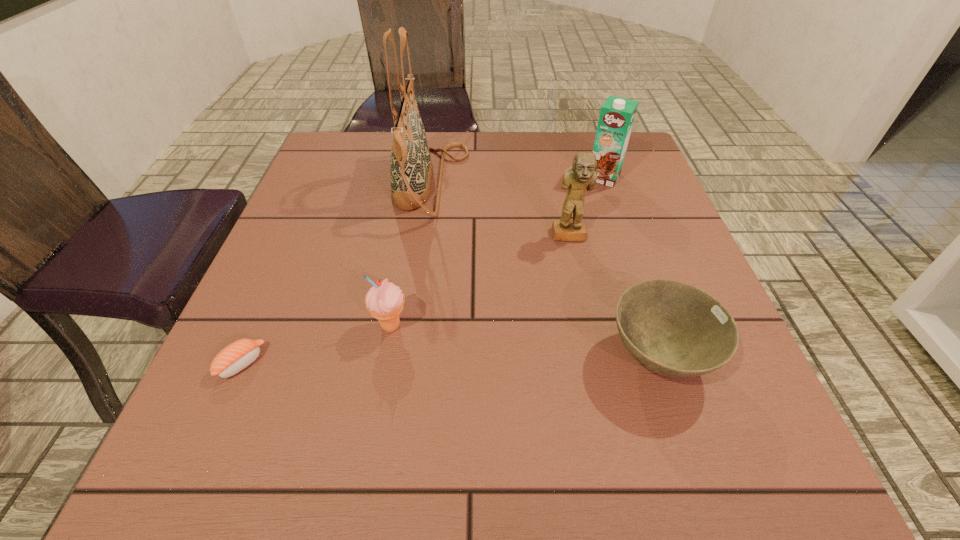
Find the location of a particular element. This screenshot has height=540, width=960. free space at the near edge is located at coordinates (637, 470).

Find the location of a particular element. This screenshot has height=540, width=960. vacant region at the left edge of the desktop is located at coordinates (288, 253).

Locate an element on the screen. Image resolution: width=960 pixels, height=540 pixels. vacant space at the right edge of the desktop is located at coordinates (636, 180).

Where is `free spot at the near right corner of the desktop`? This screenshot has width=960, height=540. free spot at the near right corner of the desktop is located at coordinates (706, 485).

At what (x,y) coordinates should I click in order to perform the action: click on free point between the leftmost object and the carton. Please return your answer as a coordinate pair (x, y). Looking at the image, I should click on (422, 270).

Locate an element on the screen. vacant point located between the third shortest object and the handbag is located at coordinates (411, 255).

Image resolution: width=960 pixels, height=540 pixels. I want to click on empty space that is in between the second shortest object and the figurine, so click(613, 296).

Find the location of a particular element. vacant point located between the handbag and the carton is located at coordinates (517, 180).

I want to click on vacant region between the handbag and the leftmost object, so click(x=336, y=273).

At what (x,y) coordinates should I click in order to perform the action: click on unoccupied area between the bowl and the tallest object. Please return your answer as a coordinate pair (x, y). The image size is (960, 540). Looking at the image, I should click on (544, 270).